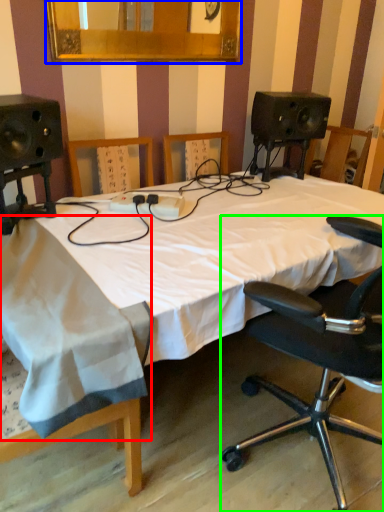
Question: Considering the real-world distances, which object is farthest from sheet (highlighted by a red box)? mirror (highlighted by a blue box) or chair (highlighted by a green box)?

Choices:
 (A) mirror
 (B) chair

Answer: (A)